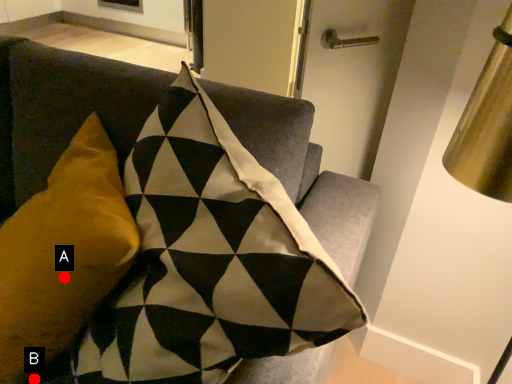
Question: Two points are circled on the image, labeled by A and B beside each circle. Which point is closer to the camera?

Choices:
 (A) A is closer
 (B) B is closer

Answer: (A)